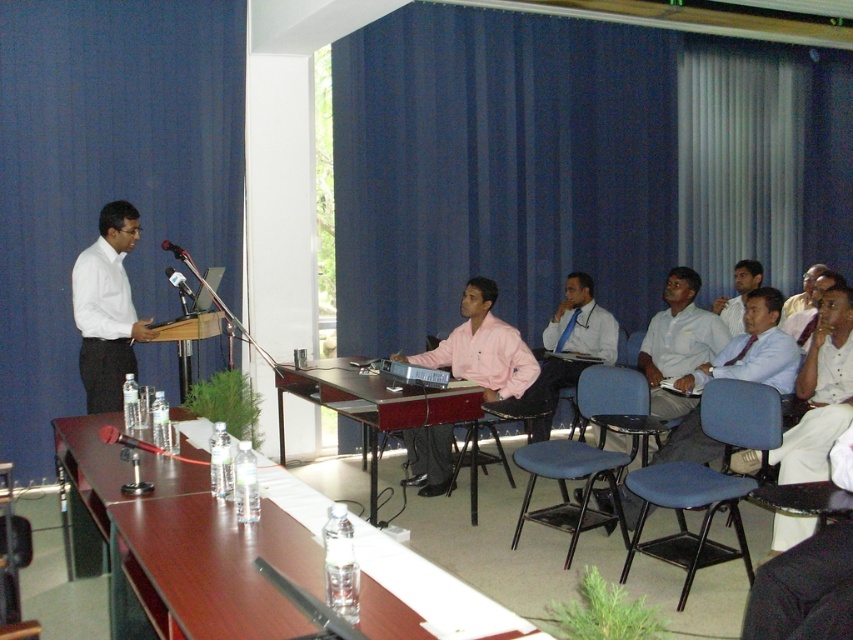
You are an event organizer and need to seat two presenters wearing the white glossy shirt at center and the light pink shirt at center. If the table has a fixed width of 1.2 meters, can both shirts fit side by side on the table without overlapping?

The white glossy shirt at center has a larger width than the light pink shirt at center. However, the combined width of both shirts would need to be less than 1.2 meters to fit side by side. Since the exact widths aren not provided, it is impossible to determine if they will fit without additional information.

You are an event organizer arranging seats for attendees. You notice the white glossy shirt at center and the pink matte shirt at center. Which shirt should you place closer to the microphone stand to ensure visibility?

The white glossy shirt at center has a lesser width compared to the pink matte shirt at center, so placing the narrower white glossy shirt at center closer to the microphone stand would allow for better visibility and space management.